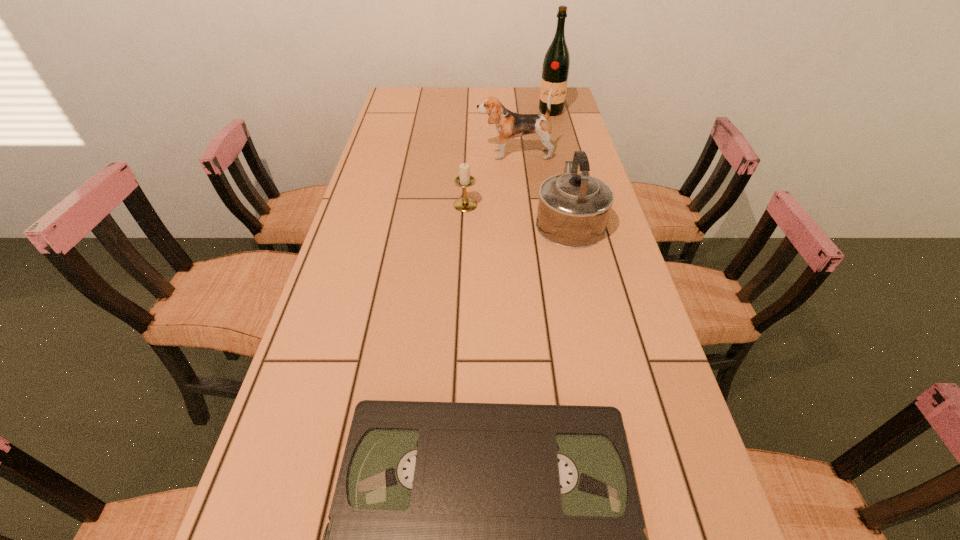
Image resolution: width=960 pixels, height=540 pixels. Identify the location of the farthest object. (556, 64).

Locate an element on the screen. This screenshot has height=540, width=960. liquor is located at coordinates (556, 64).

Find the location of a particular element. the second farthest object is located at coordinates (509, 125).

Find the location of a particular element. kettle is located at coordinates (573, 211).

At what (x,y) coordinates should I click in order to perform the action: click on candle holder. Please return your answer as a coordinate pair (x, y). Looking at the image, I should click on (465, 204).

You are a GUI agent. You are given a task and a screenshot of the screen. Output one action in this format:
    pyautogui.click(x=<x>, y=<y>)
    Task: Click on the free space located on the front-facing side of the liquor
    This screenshot has height=540, width=960.
    Given the screenshot: What is the action you would take?
    pyautogui.click(x=554, y=123)

This screenshot has width=960, height=540. In order to click on vacant point located at the face of the puppy in this screenshot , I will do `click(456, 154)`.

You are a GUI agent. You are given a task and a screenshot of the screen. Output one action in this format:
    pyautogui.click(x=<x>, y=<y>)
    Task: Click on the vacant area situated 0.180m at the face of the puppy
    
    Given the screenshot: What is the action you would take?
    pyautogui.click(x=423, y=154)

The image size is (960, 540). What are the coordinates of `vacant area located at the face of the puppy` in the screenshot? It's located at (436, 154).

Find the location of `free space located with the spout at the front of the kettle`. free space located with the spout at the front of the kettle is located at coordinates (561, 182).